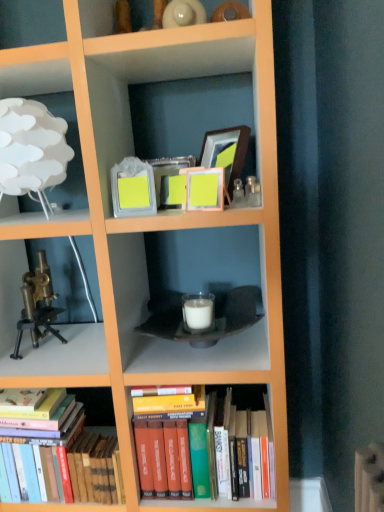
Question: Is brass metallic microscope at left oriented away from matte yellow picture frame at center, positioned as the 1th picture frame in front-to-back order?

Choices:
 (A) yes
 (B) no

Answer: (B)

Question: Is brass metallic microscope at left placed right next to matte yellow picture frame at center, positioned as the 1th picture frame in front-to-back order?

Choices:
 (A) no
 (B) yes

Answer: (A)

Question: Does brass metallic microscope at left have a lesser height compared to matte yellow picture frame at center, the 2th picture frame from the right?

Choices:
 (A) no
 (B) yes

Answer: (A)

Question: Could you tell me if brass metallic microscope at left is turned towards matte yellow picture frame at center, positioned as the 1th picture frame in front-to-back order?

Choices:
 (A) yes
 (B) no

Answer: (B)

Question: Can you confirm if brass metallic microscope at left is thinner than matte yellow picture frame at center, the second picture frame from the left?

Choices:
 (A) no
 (B) yes

Answer: (A)

Question: From a real-world perspective, does brass metallic microscope at left stand above matte yellow picture frame at center, the second picture frame from the left?

Choices:
 (A) yes
 (B) no

Answer: (B)

Question: Considering the relative sizes of brass metallic microscope at left and hardcover books at center, the 2th book viewed from the left, in the image provided, is brass metallic microscope at left wider than hardcover books at center, the 2th book viewed from the left,?

Choices:
 (A) no
 (B) yes

Answer: (A)

Question: Is brass metallic microscope at left far away from hardcover books at center, the first book viewed from the right?

Choices:
 (A) no
 (B) yes

Answer: (A)

Question: Is brass metallic microscope at left to the right of hardcover books at center, the 2th book viewed from the left, from the viewer's perspective?

Choices:
 (A) yes
 (B) no

Answer: (B)

Question: Is brass metallic microscope at left placed right next to hardcover books at center, the 2th book viewed from the left?

Choices:
 (A) no
 (B) yes

Answer: (A)

Question: Is brass metallic microscope at left positioned in front of hardcover books at center, the 2th book viewed from the left?

Choices:
 (A) yes
 (B) no

Answer: (B)

Question: Considering the relative positions of brass metallic microscope at left and hardcover books at center, the 2th book viewed from the left, in the image provided, is brass metallic microscope at left to the left of hardcover books at center, the 2th book viewed from the left, from the viewer's perspective?

Choices:
 (A) no
 (B) yes

Answer: (B)

Question: Is hardcover books at lower left, acting as the first book starting from the left, positioned far away from matte glass picture frame at upper center, which ranks as the first picture frame in left-to-right order?

Choices:
 (A) no
 (B) yes

Answer: (A)